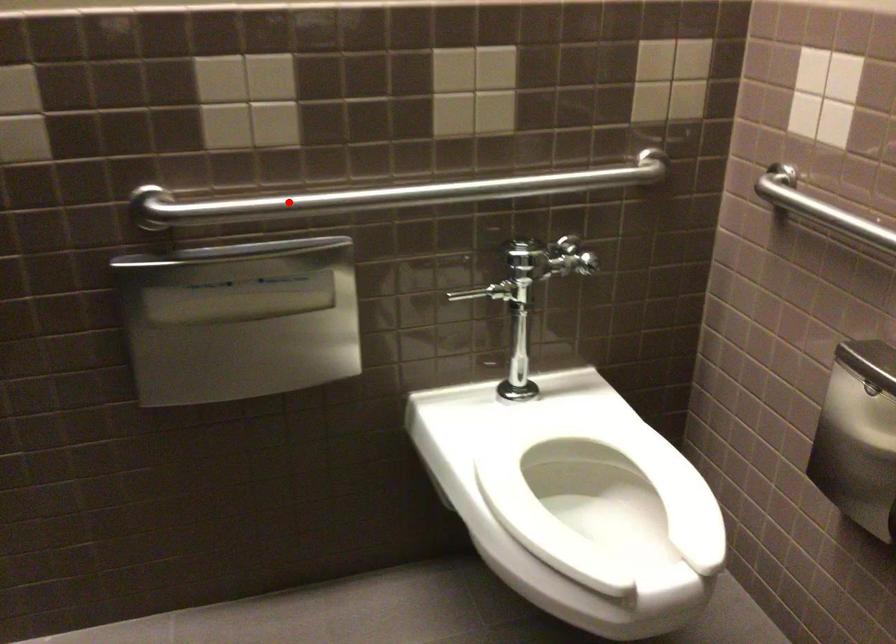
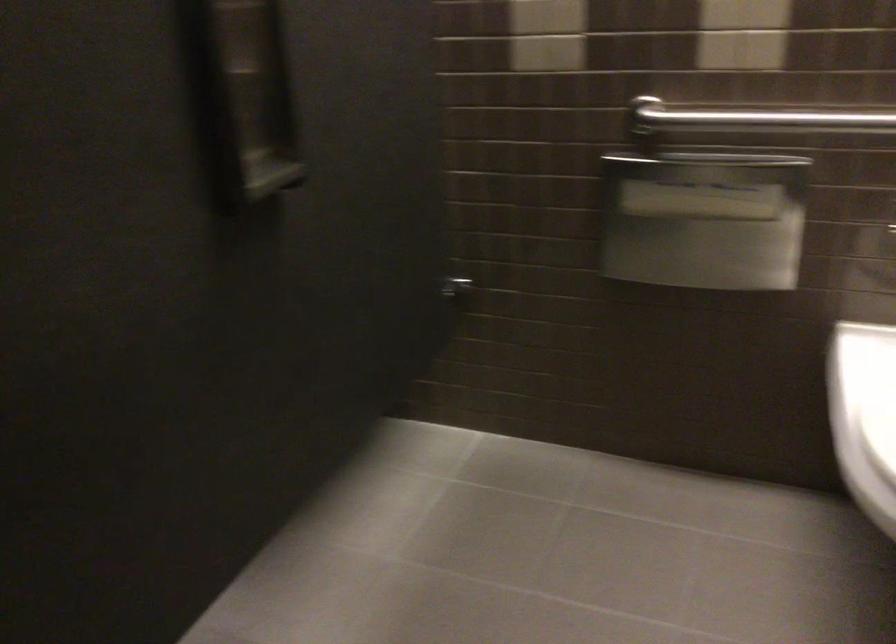
Question: I am providing you with two images of the same scene from different viewpoints. Given a red point in image1, look at the same physical point in image2. Is it:

Choices:
 (A) Closer to the viewpoint
 (B) Farther from the viewpoint

Answer: (B)